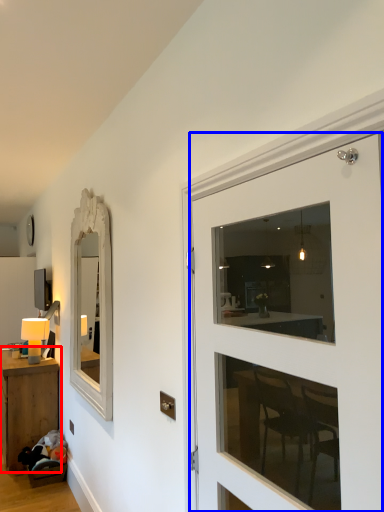
Question: Which object is closer to the camera taking this photo, table (highlighted by a red box) or door (highlighted by a blue box)?

Choices:
 (A) table
 (B) door

Answer: (B)